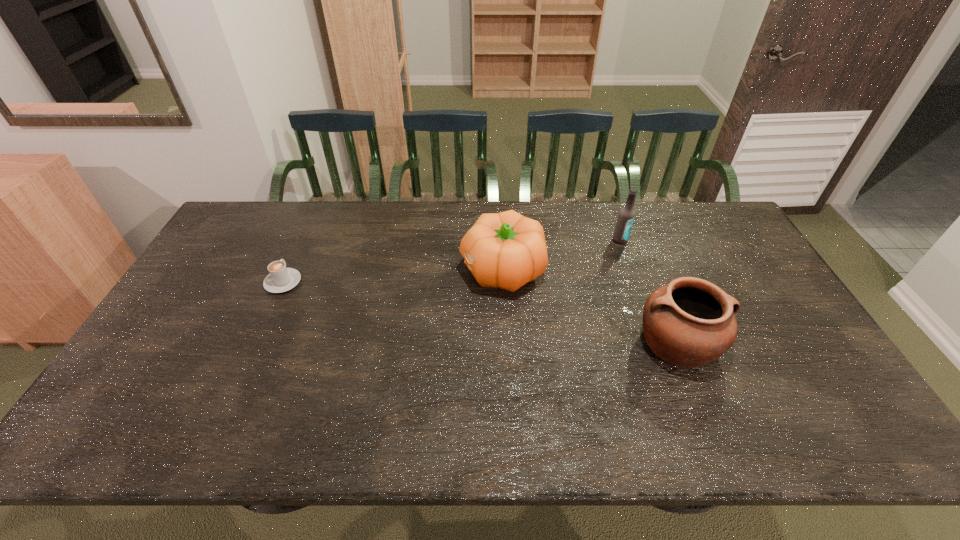
The width and height of the screenshot is (960, 540). Find the location of `blank area located 0.130m on the back of the third tallest object`. blank area located 0.130m on the back of the third tallest object is located at coordinates 653,280.

This screenshot has height=540, width=960. What are the coordinates of `vacant space located to the right of the cappuccino` in the screenshot? It's located at (316, 211).

You are a GUI agent. You are given a task and a screenshot of the screen. Output one action in this format:
    pyautogui.click(x=<x>, y=<y>)
    Task: Click on the free space located to the right of the cappuccino
    This screenshot has height=540, width=960.
    Given the screenshot: What is the action you would take?
    pyautogui.click(x=304, y=236)

Find the location of a particular element. vacant region located 0.060m to the right of the cappuccino is located at coordinates (295, 258).

The width and height of the screenshot is (960, 540). I want to click on beer bottle at the far edge, so click(626, 216).

Locate an element on the screen. The width and height of the screenshot is (960, 540). pumpkin that is at the far edge is located at coordinates (506, 250).

Find the location of a particular element. The image size is (960, 540). free space at the far edge of the desktop is located at coordinates [570, 239].

This screenshot has width=960, height=540. What are the coordinates of `free space at the near edge` in the screenshot? It's located at (438, 421).

Where is `free region at the left edge`? The height and width of the screenshot is (540, 960). free region at the left edge is located at coordinates (236, 262).

In the image, there is a desktop. Where is `free region at the right edge`? Image resolution: width=960 pixels, height=540 pixels. free region at the right edge is located at coordinates (706, 243).